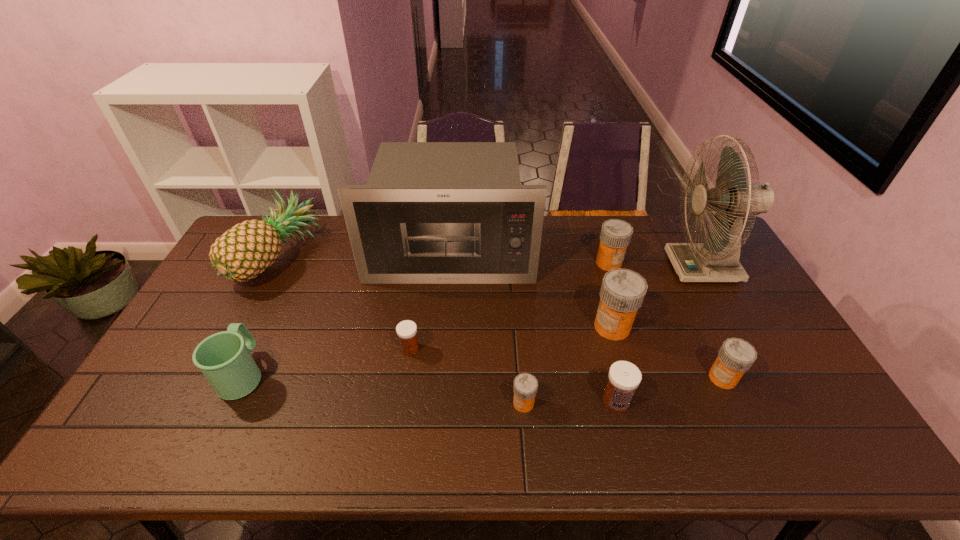
Locate an element on the screen. This screenshot has width=960, height=540. the rightmost orange medicine is located at coordinates [x=736, y=356].

At what (x,y) coordinates should I click in order to perform the action: click on the third farthest orange medicine. Please return your answer as a coordinate pair (x, y). Looking at the image, I should click on (736, 356).

Identify the location of the bigger white medicine. (624, 377).

The height and width of the screenshot is (540, 960). I want to click on the nearer white medicine, so click(x=624, y=377).

Where is `the farther white medicine`? Image resolution: width=960 pixels, height=540 pixels. the farther white medicine is located at coordinates (406, 330).

The height and width of the screenshot is (540, 960). Identify the location of the smaller white medicine. (406, 330).

Find the location of a particular element. This screenshot has width=960, height=540. the nearest orange medicine is located at coordinates tap(525, 386).

Locate an element on the screen. The image size is (960, 540). the second medicine from left to right is located at coordinates (525, 386).

I want to click on vacant space located 0.100m on the front-facing side of the fan, so point(641,267).

Find the location of a particular element. vacant area situated on the front-facing side of the fan is located at coordinates (630, 267).